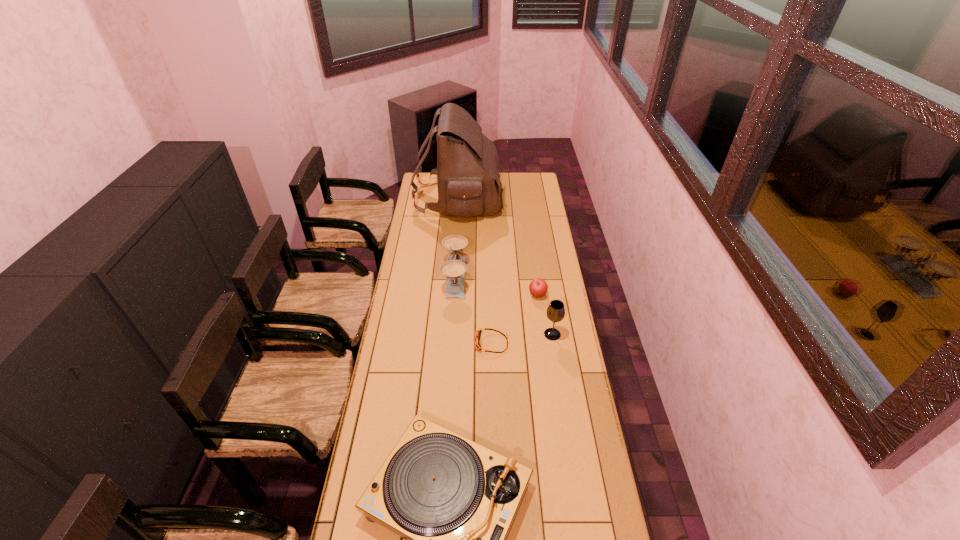
Where is `free space located with the lenses facing forward on the shortest object`? This screenshot has height=540, width=960. free space located with the lenses facing forward on the shortest object is located at coordinates (424, 343).

Where is `vacant space located with the lenses facing forward on the shortest object`? Image resolution: width=960 pixels, height=540 pixels. vacant space located with the lenses facing forward on the shortest object is located at coordinates (403, 343).

This screenshot has height=540, width=960. In order to click on free space located with the lenses facing forward on the shortest object in this screenshot , I will do `click(439, 343)`.

The width and height of the screenshot is (960, 540). Find the location of `object that is at the far edge`. object that is at the far edge is located at coordinates (467, 170).

Find the location of a particular element. The width and height of the screenshot is (960, 540). object present at the left edge is located at coordinates (467, 170).

Where is `wineglass located in the right edge section of the desktop`? The width and height of the screenshot is (960, 540). wineglass located in the right edge section of the desktop is located at coordinates (555, 312).

This screenshot has height=540, width=960. Identify the location of apple that is at the right edge. (538, 288).

Image resolution: width=960 pixels, height=540 pixels. I want to click on object at the far left corner, so click(x=467, y=170).

Where is `free spot at the left edge of the desktop`? This screenshot has height=540, width=960. free spot at the left edge of the desktop is located at coordinates (372, 415).

You are a GUI agent. You are given a task and a screenshot of the screen. Output one action in this format:
    pyautogui.click(x=<x>, y=<y>)
    Task: Click on the vacant space at the right edge
    Image resolution: width=960 pixels, height=540 pixels.
    Given the screenshot: What is the action you would take?
    pyautogui.click(x=535, y=265)